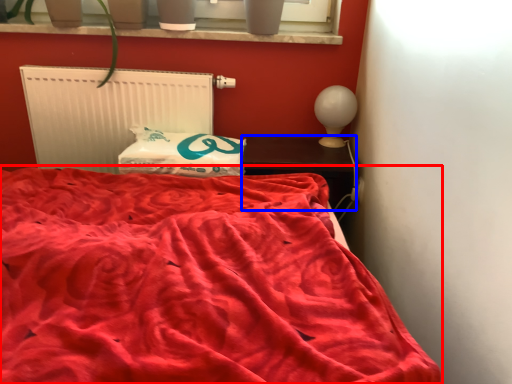
Question: Which point is closer to the camera, bed (highlighted by a red box) or furniture (highlighted by a blue box)?

Choices:
 (A) bed
 (B) furniture

Answer: (A)